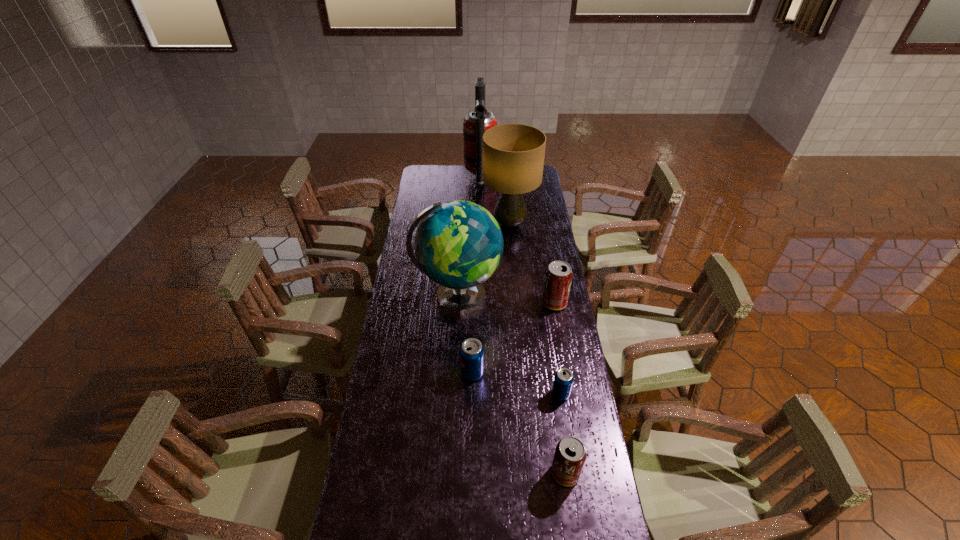
Find the location of `the smaller red soda can`. the smaller red soda can is located at coordinates (570, 455).

Where is `the second nearest object`? Image resolution: width=960 pixels, height=540 pixels. the second nearest object is located at coordinates (563, 380).

Where is `the second nearest pop soda`? Image resolution: width=960 pixels, height=540 pixels. the second nearest pop soda is located at coordinates (563, 380).

Where is `free region located 0.100m on the front label side of the red fire extinguisher`? This screenshot has width=960, height=540. free region located 0.100m on the front label side of the red fire extinguisher is located at coordinates (447, 178).

This screenshot has width=960, height=540. I want to click on free space located on the front label side of the red fire extinguisher, so click(423, 178).

Find the location of `vacant area located on the front label side of the red fire extinguisher`. vacant area located on the front label side of the red fire extinguisher is located at coordinates (432, 178).

Where is `free location located on the back of the sixth nearest object`? The height and width of the screenshot is (540, 960). free location located on the back of the sixth nearest object is located at coordinates (508, 198).

I want to click on vacant space located 0.170m on the front surface of the globe, so click(x=541, y=297).

Locate an element on the screen. The width and height of the screenshot is (960, 540). free space located 0.130m on the front of the farthest pop soda is located at coordinates (561, 337).

Locate an element on the screen. free space located 0.400m on the front of the leftmost pop soda is located at coordinates (470, 502).